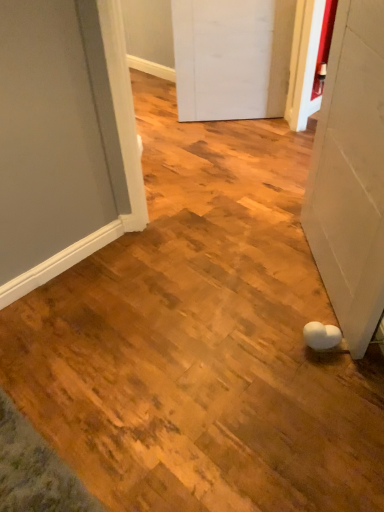
The width and height of the screenshot is (384, 512). Identify the location of vacant area that is in front of white matte door at center, marked as the first door in a top-to-bottom arrangement. (239, 143).